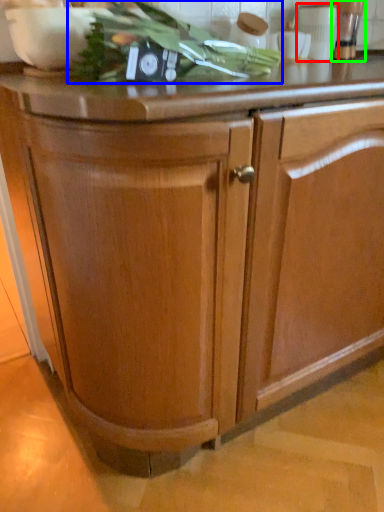
Question: Which object is the closest to the appliance (highlighted by a red box)? Choose among these: vegetable (highlighted by a blue box) or appliance (highlighted by a green box).

Choices:
 (A) vegetable
 (B) appliance

Answer: (B)